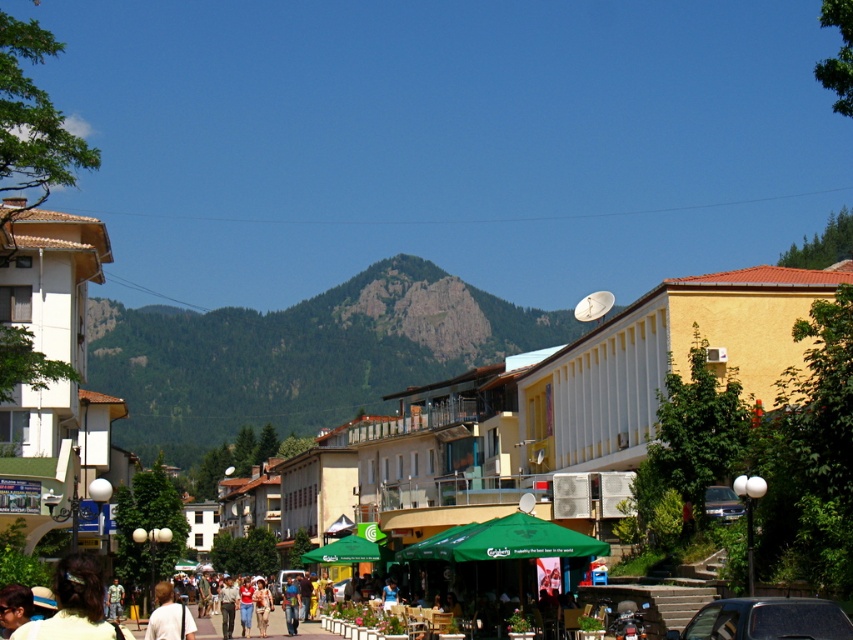
Question: Which of the following is the farthest from the observer?

Choices:
 (A) metallic silver car at lower right
 (B) dark brown hair at lower left
 (C) black glossy car at center

Answer: (A)

Question: Which point is farther to the camera?

Choices:
 (A) (722, 499)
 (B) (73, 609)
 (C) (451, 372)
 (D) (785, 602)

Answer: (C)

Question: Does green rocky mountain at center appear under light brown hair at lower left?

Choices:
 (A) yes
 (B) no

Answer: (B)

Question: Estimate the real-world distances between objects in this image. Which object is closer to the dark brown hair at lower left?

Choices:
 (A) black glossy car at center
 (B) green rocky mountain at center
 (C) light brown hair at lower left
 (D) light brown hair at center

Answer: (C)

Question: Is light brown hair at center smaller than dark brown hair at lower left?

Choices:
 (A) no
 (B) yes

Answer: (A)

Question: Is light brown hair at center thinner than dark brown hair at lower left?

Choices:
 (A) no
 (B) yes

Answer: (A)